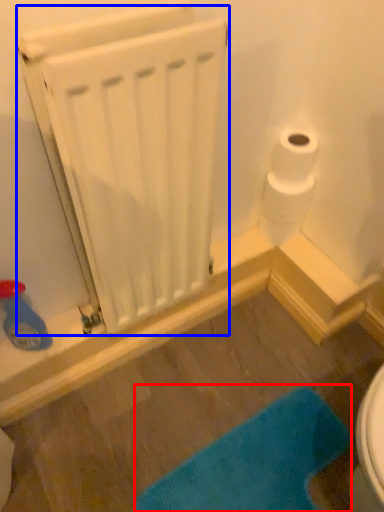
Question: Which object is closer to the camera taking this photo, bath mat (highlighted by a red box) or radiator (highlighted by a blue box)?

Choices:
 (A) bath mat
 (B) radiator

Answer: (B)